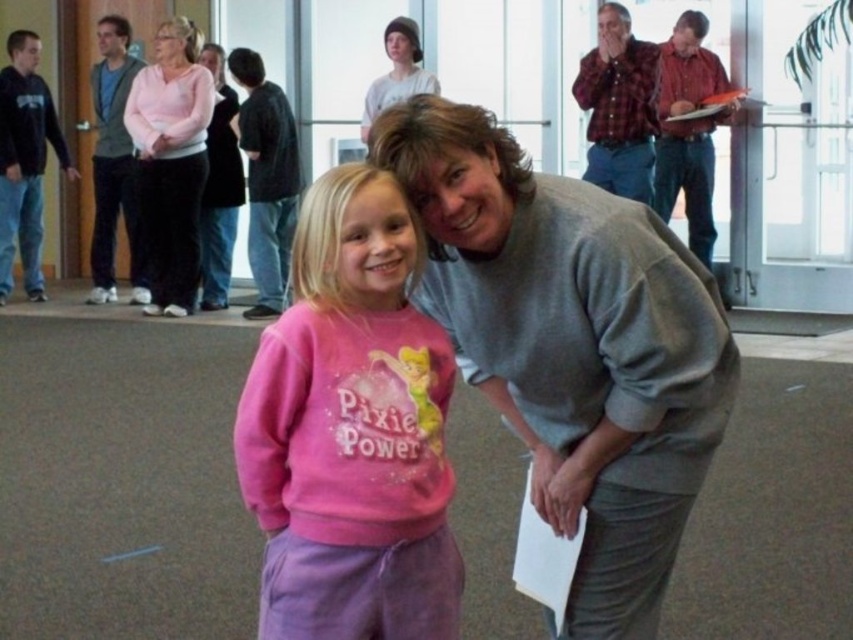
Who is positioned more to the right, plaid flannel shirt at upper right or pink sweater at upper left?

From the viewer's perspective, plaid flannel shirt at upper right appears more on the right side.

Between point (601, 144) and point (135, 56), which one is positioned in front?

Point (601, 144) is more forward.

Is point (630, 74) positioned after point (100, 166)?

No, it is not.

You are a GUI agent. You are given a task and a screenshot of the screen. Output one action in this format:
    pyautogui.click(x=<x>, y=<y>)
    Task: Click on the plaid flannel shirt at upper right
    
    Given the screenshot: What is the action you would take?
    pyautogui.click(x=619, y=106)

Who is shorter, pink sweater at upper left or gray sweater at upper center?

gray sweater at upper center

Between point (134, 205) and point (387, 76), which one is positioned behind?

Positioned behind is point (134, 205).

I want to click on pink sweater at upper left, so click(114, 164).

Is gray sweater at center positioned behind plaid shirt at upper right?

No, gray sweater at center is in front of plaid shirt at upper right.

How far apart are gray sweater at center and plaid shirt at upper right?

gray sweater at center is 19.40 feet from plaid shirt at upper right.

Which is behind, point (726, 404) or point (672, 60)?

Point (672, 60)

The image size is (853, 640). Identify the location of gray sweater at center. [x=572, y=346].